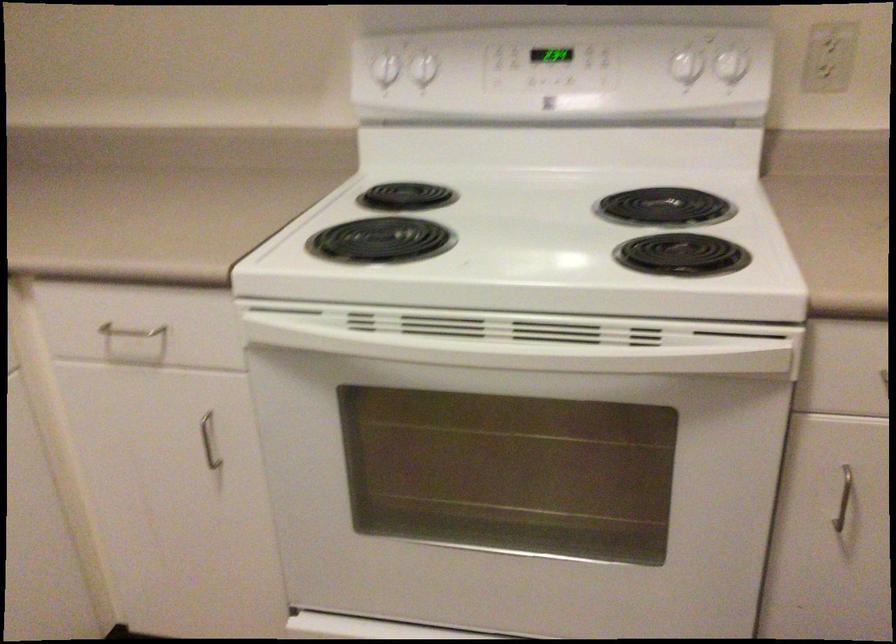
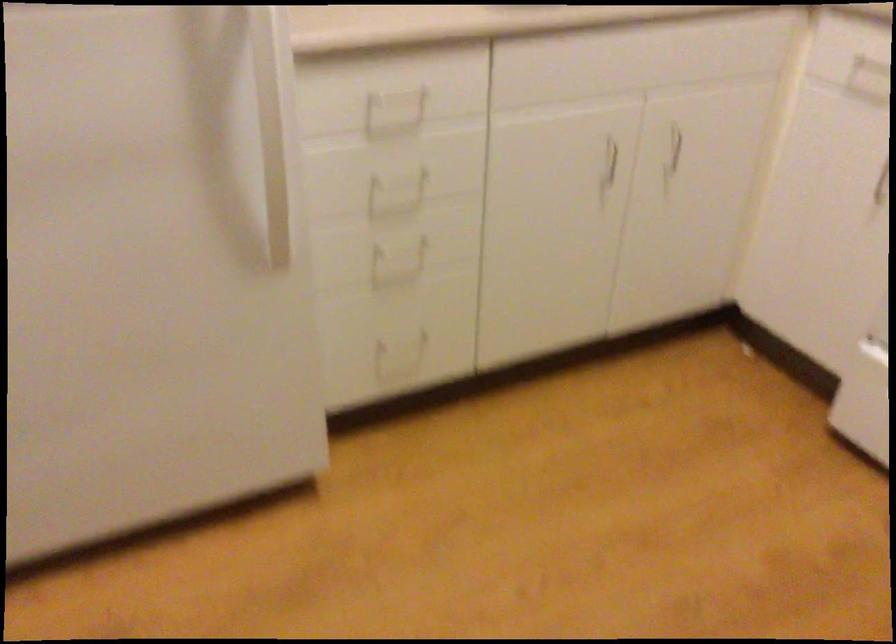
The first image is from the beginning of the video and the second image is from the end. How did the camera likely rotate when shooting the video?

The camera's rotation is toward left-down.